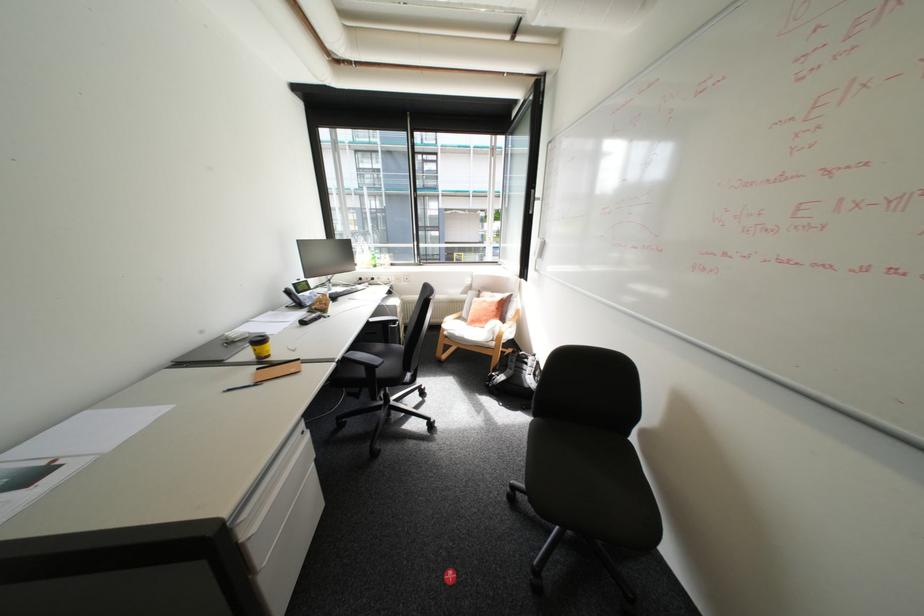
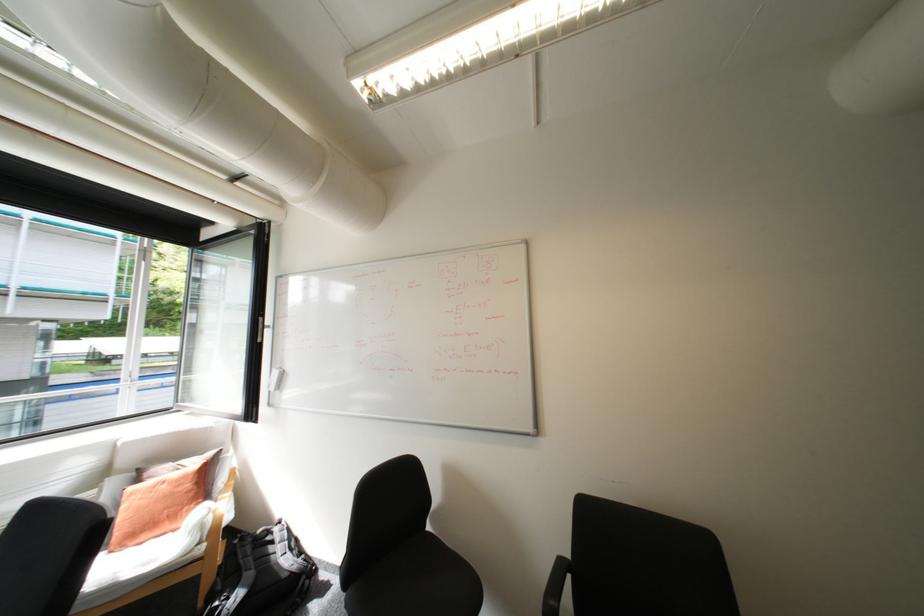
Find the pixel in the second image that matches the point at 477,323 in the first image.

(122, 552)